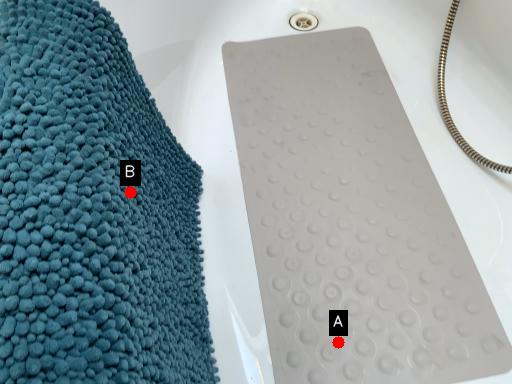
Question: Two points are circled on the image, labeled by A and B beside each circle. Which point is closer to the camera taking this photo?

Choices:
 (A) A is closer
 (B) B is closer

Answer: (B)